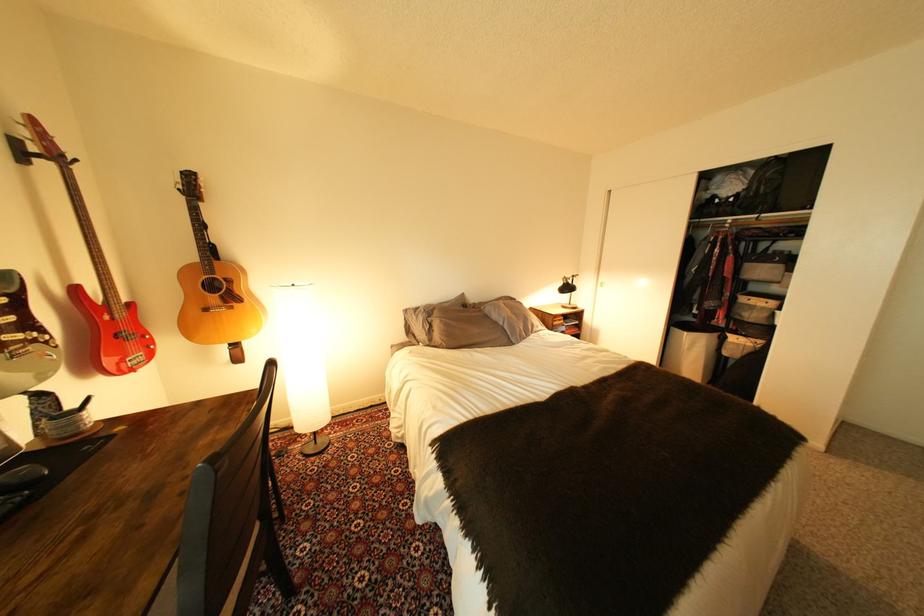
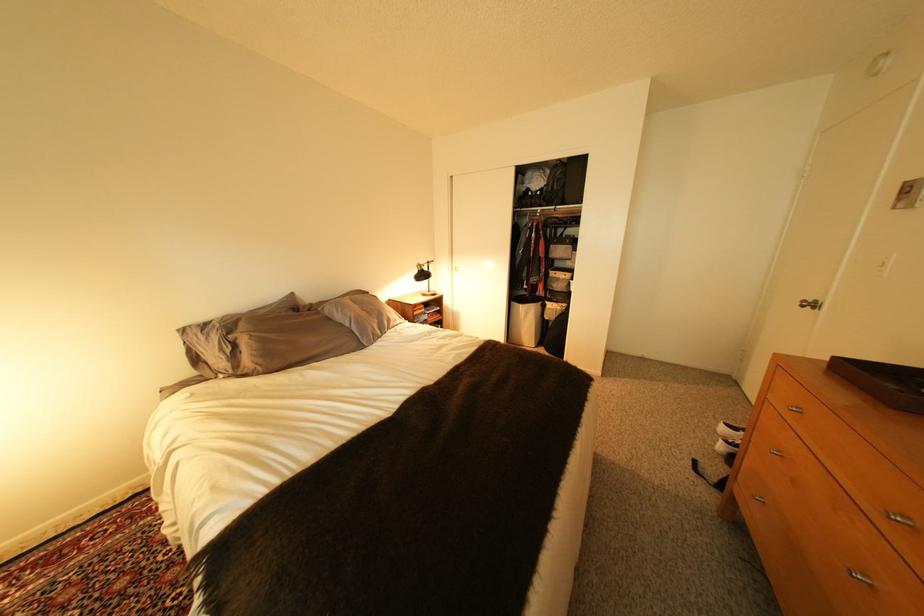
Where in the second image is the point corresponding to [698,334] from the first image?

(533, 307)